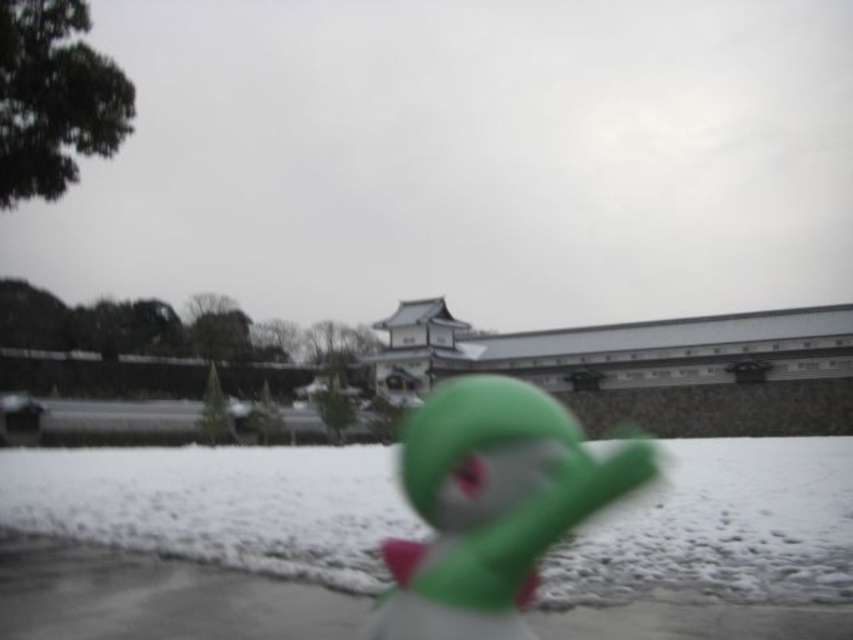
This screenshot has width=853, height=640. Describe the element at coordinates (198, 536) in the screenshot. I see `white fluffy snow at center` at that location.

Consider the image. Who is more distant from viewer, (x=602, y=560) or (x=527, y=390)?

Result: The point (x=602, y=560) is more distant.

What are the coordinates of `white fluffy snow at center` in the screenshot? It's located at (198, 536).